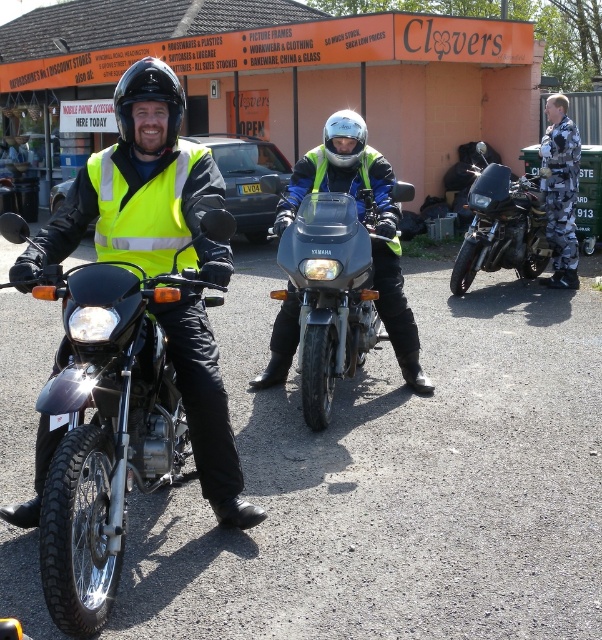
Question: Does matte black motorcycle at center have a smaller size compared to black matte helmet at upper left?

Choices:
 (A) yes
 (B) no

Answer: (B)

Question: Can you confirm if yellow reflective safety vest at left is wider than camouflage uniform at right?

Choices:
 (A) yes
 (B) no

Answer: (A)

Question: Which of these objects is positioned farthest from the shiny black motorcycle at right?

Choices:
 (A) camouflage uniform at right
 (B) glossy white helmet at center
 (C) matte black motorcycle at left

Answer: (C)

Question: In this image, where is matte black motorcycle at center located relative to black matte helmet at upper left?

Choices:
 (A) left
 (B) right

Answer: (B)

Question: Based on their relative distances, which object is farther from the camouflage uniform at right?

Choices:
 (A) matte black motorcycle at center
 (B) glossy white helmet at center
 (C) black matte helmet at upper left
 (D) matte black motorcycle at left

Answer: (D)

Question: Among these points, which one is nearest to the camera?

Choices:
 (A) [x=573, y=211]
 (B) [x=157, y=440]
 (C) [x=544, y=266]
 (D) [x=125, y=214]

Answer: (B)